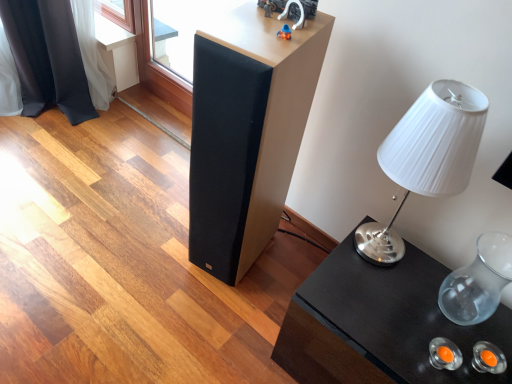
Where is `free spot above black glossy table at lower right (from a real-world perspective)`? The image size is (512, 384). free spot above black glossy table at lower right (from a real-world perspective) is located at coordinates (415, 316).